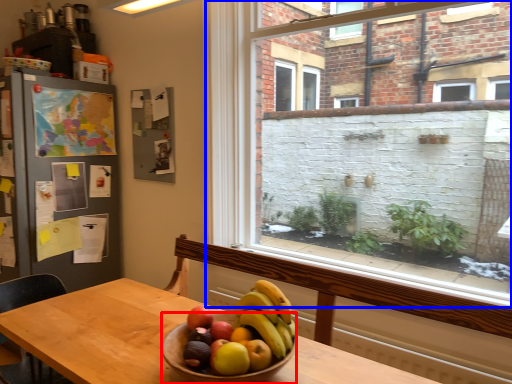
Question: Which point is further to the camera, bowl (highlighted by a red box) or window (highlighted by a blue box)?

Choices:
 (A) bowl
 (B) window

Answer: (B)